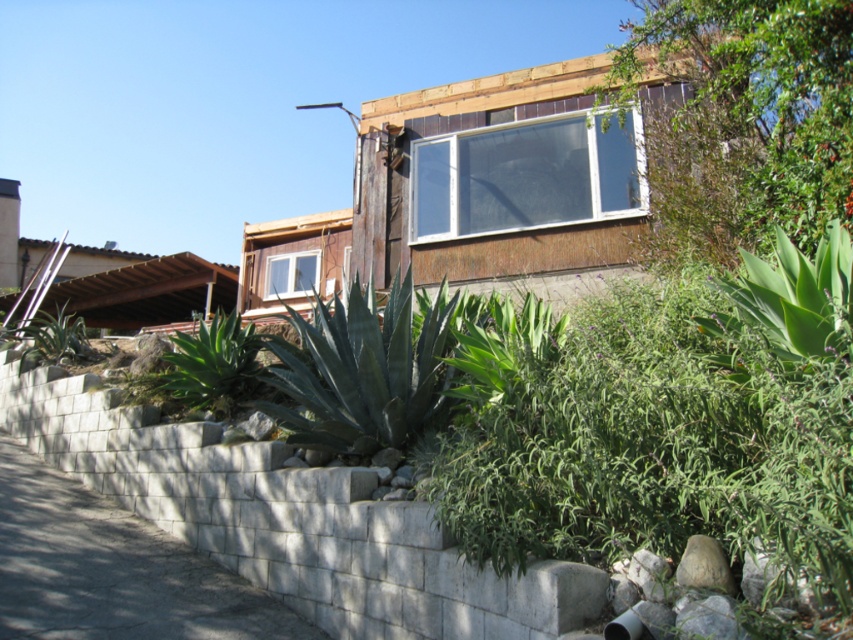
Does green leafy plant at center have a smaller size compared to green leafy plant at lower left?

Indeed, green leafy plant at center has a smaller size compared to green leafy plant at lower left.

Is green leafy plant at center to the right of green leafy plant at lower left from the viewer's perspective?

Yes, green leafy plant at center is to the right of green leafy plant at lower left.

Which is in front, point (251, 356) or point (47, 337)?

Point (251, 356) is more forward.

Find the location of a particular element. green leafy plant at center is located at coordinates (213, 364).

Measure the distance between point (x=293, y=440) and camera.

Point (x=293, y=440) is 5.46 meters from camera.

The height and width of the screenshot is (640, 853). What do you see at coordinates (363, 369) in the screenshot?
I see `dark green leafy plant at center` at bounding box center [363, 369].

The image size is (853, 640). Describe the element at coordinates (363, 369) in the screenshot. I see `dark green leafy plant at center` at that location.

This screenshot has width=853, height=640. I want to click on dark green leafy plant at center, so click(363, 369).

Which is behind, point (361, 387) or point (183, 339)?

The point (183, 339) is more distant.

Can you confirm if dark green leafy plant at center is positioned below green leafy plant at center?

Actually, dark green leafy plant at center is above green leafy plant at center.

Who is more distant from viewer, (421, 332) or (181, 364)?

Point (181, 364)

At what (x,y) coordinates should I click in order to perform the action: click on dark green leafy plant at center. Please return your answer as a coordinate pair (x, y). Looking at the image, I should click on (363, 369).